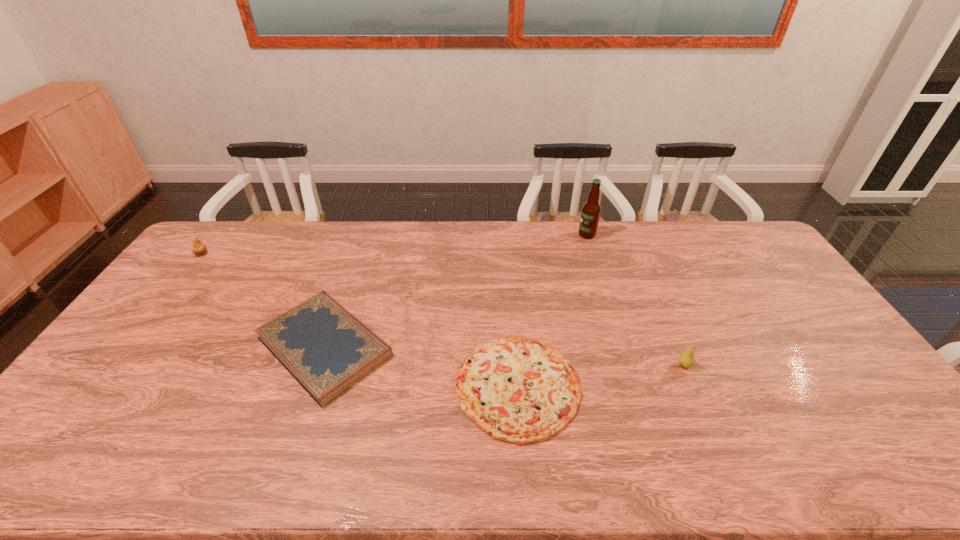
Where is `unoccupied area between the fourth object from right to left and the pizza`? The image size is (960, 540). unoccupied area between the fourth object from right to left and the pizza is located at coordinates (420, 366).

You are a GUI agent. You are given a task and a screenshot of the screen. Output one action in this format:
    pyautogui.click(x=<x>, y=<y>)
    Task: Click on the vacant space in between the fourth nearest object and the second shortest object
    The image size is (960, 540).
    Given the screenshot: What is the action you would take?
    pyautogui.click(x=263, y=300)

Locate an element on the screen. The height and width of the screenshot is (540, 960). free space between the nearer pear and the tallest object is located at coordinates (636, 300).

Identify the location of empty location between the fourth object from right to left and the leftmost object. (263, 300).

This screenshot has width=960, height=540. Find the location of `vacant area that lies between the second object from right to left and the pizza`. vacant area that lies between the second object from right to left and the pizza is located at coordinates (552, 310).

What are the coordinates of `vacant region between the tallest object and the nearer pear` in the screenshot? It's located at (636, 300).

Where is `object that ranks as the fourth closest to the fourth object from right to left`? This screenshot has height=540, width=960. object that ranks as the fourth closest to the fourth object from right to left is located at coordinates (686, 358).

The image size is (960, 540). In order to click on object that is the closest to the pizza in this screenshot , I will do `click(321, 344)`.

The width and height of the screenshot is (960, 540). I want to click on free space that satisfies the following two spatial constraints: 1. on the front side of the paperback book; 2. on the left side of the nearer pear, so click(x=318, y=365).

This screenshot has height=540, width=960. What are the coordinates of `vacant position in the image that satisfies the following two spatial constraints: 1. on the label of the beer bottle; 2. on the front side of the shortest object` in the screenshot? It's located at (635, 386).